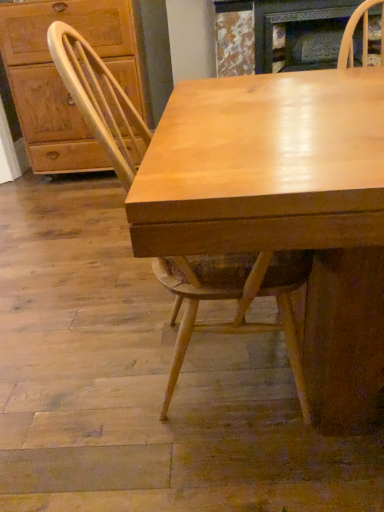
This screenshot has height=512, width=384. Describe the element at coordinates (290, 21) in the screenshot. I see `marble textured fireplace at upper center` at that location.

The width and height of the screenshot is (384, 512). I want to click on light wood chair at center, so click(x=234, y=298).

You are a GUI agent. You are given a task and a screenshot of the screen. Output one action in this format:
    pyautogui.click(x=<x>, y=<y>)
    Task: Click on the matte wood cabinet at left
    The height and width of the screenshot is (512, 384).
    Given the screenshot: What is the action you would take?
    pyautogui.click(x=61, y=80)

At what (x,y) coordinates should I click in order to perform the action: click on marble textured fireplace at upper center. Please return your answer as a coordinate pair (x, y). The height and width of the screenshot is (512, 384). Looking at the image, I should click on (290, 21).

From a real-world perspective, relative to marble textured fireplace at upper center, is matte wood cabinet at left vertically above or below?

In terms of real-world spatial position, matte wood cabinet at left is below marble textured fireplace at upper center.

Considering the relative sizes of matte wood cabinet at left and marble textured fireplace at upper center in the image provided, is matte wood cabinet at left thinner than marble textured fireplace at upper center?

No, matte wood cabinet at left is not thinner than marble textured fireplace at upper center.

Relative to marble textured fireplace at upper center, is matte wood cabinet at left in front or behind?

Visually, matte wood cabinet at left is located behind marble textured fireplace at upper center.

Between matte wood cabinet at left and marble textured fireplace at upper center, which one has larger size?

Bigger between the two is matte wood cabinet at left.

Can you confirm if light wood chair at center is smaller than matte wood cabinet at left?

Correct, light wood chair at center occupies less space than matte wood cabinet at left.

Is there a large distance between light wood chair at center and matte wood cabinet at left?

light wood chair at center is positioned a significant distance from matte wood cabinet at left.

Is point (93, 72) more distant than point (56, 115)?

No.

Does marble textured fireplace at upper center come in front of matte wood cabinet at left?

Yes, marble textured fireplace at upper center is closer to the camera.

Is marble textured fireplace at upper center with matte wood cabinet at left?

No, marble textured fireplace at upper center is not beside matte wood cabinet at left.

From the image's perspective, is marble textured fireplace at upper center beneath matte wood cabinet at left?

Incorrect, from the image's perspective, marble textured fireplace at upper center is higher than matte wood cabinet at left.

Does marble textured fireplace at upper center appear on the left side of matte wood cabinet at left?

No, marble textured fireplace at upper center is not to the left of matte wood cabinet at left.

Can you confirm if light wood chair at center is positioned to the left of marble textured fireplace at upper center?

Correct, you'll find light wood chair at center to the left of marble textured fireplace at upper center.

Can you confirm if light wood chair at center is taller than marble textured fireplace at upper center?

Correct, light wood chair at center is much taller as marble textured fireplace at upper center.

Can you tell me how much light wood chair at center and marble textured fireplace at upper center differ in facing direction?

There is a 88.6-degree angle between the facing directions of light wood chair at center and marble textured fireplace at upper center.

From the picture: Is light wood chair at center spatially inside marble textured fireplace at upper center, or outside of it?

light wood chair at center is not inside marble textured fireplace at upper center, it's outside.

Is matte wood cabinet at left turned away from light wood chair at center?

matte wood cabinet at left is not turned away from light wood chair at center.

Are matte wood cabinet at left and light wood chair at center far apart?

That's right, there is a large distance between matte wood cabinet at left and light wood chair at center.

Considering the sizes of matte wood cabinet at left and light wood chair at center in the image, is matte wood cabinet at left wider or thinner than light wood chair at center?

Considering their sizes, matte wood cabinet at left looks slimmer than light wood chair at center.

Does matte wood cabinet at left appear on the left side of light wood chair at center?

Indeed, matte wood cabinet at left is positioned on the left side of light wood chair at center.

Which point is more forward, (280, 14) or (170, 401)?

Point (170, 401)

From the image's perspective, is marble textured fireplace at upper center above or below light wood chair at center?

From the image's perspective, marble textured fireplace at upper center appears above light wood chair at center.

Choose the correct answer: Is marble textured fireplace at upper center inside light wood chair at center or outside it?

marble textured fireplace at upper center is outside light wood chair at center.

From a real-world perspective, who is located lower, marble textured fireplace at upper center or light wood chair at center?

From a 3D spatial view, light wood chair at center is below.

Locate an element on the screen. cabinetry directly beneath the marble textured fireplace at upper center (from a real-world perspective) is located at coordinates (61, 80).

Locate an element on the screen. This screenshot has width=384, height=512. chair lying on the right of matte wood cabinet at left is located at coordinates (234, 298).

Estimate the real-world distances between objects in this image. Which object is closer to light wood chair at center, marble textured fireplace at upper center or matte wood cabinet at left?

Among the two, matte wood cabinet at left is located nearer to light wood chair at center.

Based on their spatial positions, is matte wood cabinet at left or marble textured fireplace at upper center closer to light wood chair at center?

The object closer to light wood chair at center is matte wood cabinet at left.

When comparing their distances from marble textured fireplace at upper center, does matte wood cabinet at left or light wood chair at center seem closer?

matte wood cabinet at left is positioned closer to the anchor marble textured fireplace at upper center.

Estimate the real-world distances between objects in this image. Which object is further from matte wood cabinet at left, marble textured fireplace at upper center or light wood chair at center?

light wood chair at center lies further to matte wood cabinet at left than the other object.

Based on their spatial positions, is light wood chair at center or matte wood cabinet at left further from marble textured fireplace at upper center?

light wood chair at center.

Estimate the real-world distances between objects in this image. Which object is closer to matte wood cabinet at left, light wood chair at center or marble textured fireplace at upper center?

marble textured fireplace at upper center is closer to matte wood cabinet at left.

Locate an element on the screen. fireplace between light wood chair at center and matte wood cabinet at left in the front-back direction is located at coordinates (290, 21).